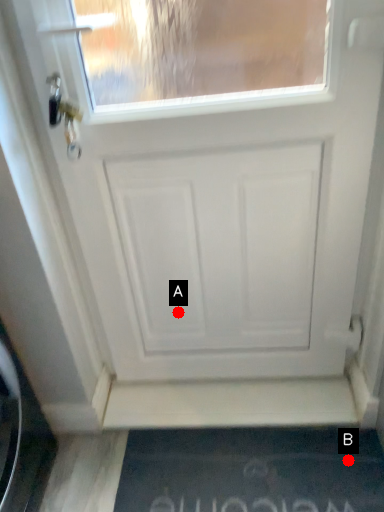
Question: Two points are circled on the image, labeled by A and B beside each circle. Which point is further to the camera?

Choices:
 (A) A is further
 (B) B is further

Answer: (A)